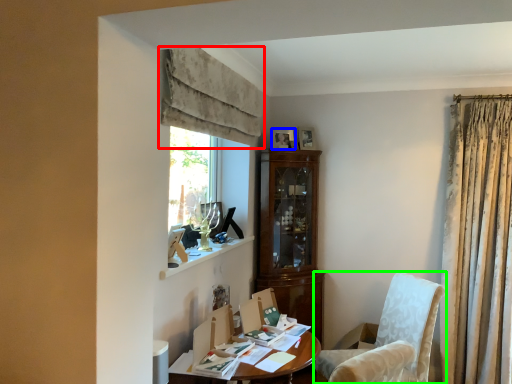
Question: Which is farther away from curtain (highlighted by a red box)? picture frame (highlighted by a blue box) or chair (highlighted by a green box)?

Choices:
 (A) picture frame
 (B) chair

Answer: (B)